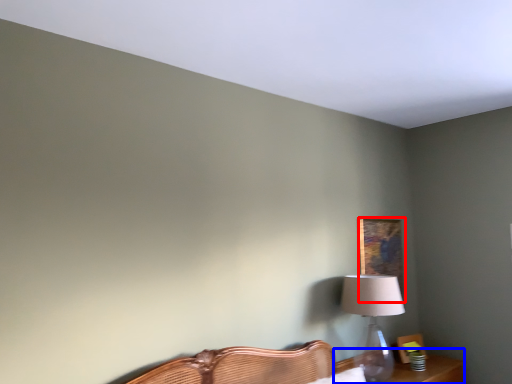
Question: Which of the following is the farthest to the observer, picture frame (highlighted by a red box) or table (highlighted by a blue box)?

Choices:
 (A) picture frame
 (B) table

Answer: (A)